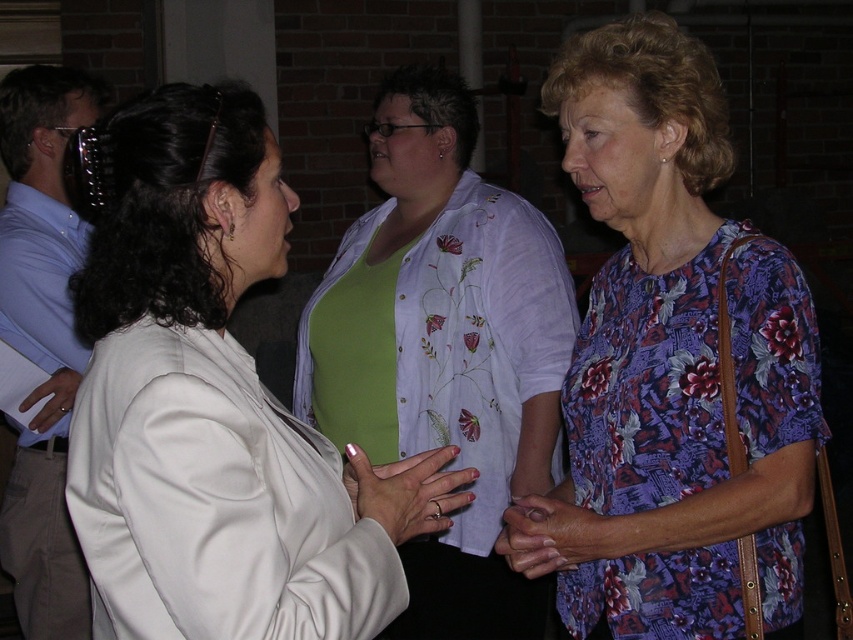
Based on the photo, is light blue shirt at left taller than matte white hand at center?

Yes.

Looking at this image, who is more forward, (15,280) or (352,468)?

Positioned in front is point (352,468).

I want to click on light blue shirt at left, so click(42, 339).

Locate an element on the screen. This screenshot has height=640, width=853. matte white blazer at left is located at coordinates (216, 406).

Is matte white blazer at left shorter than green embroidered blouse at center?

Yes.

Where is `matte white blazer at left`? This screenshot has height=640, width=853. matte white blazer at left is located at coordinates (216, 406).

What do you see at coordinates (42, 339) in the screenshot?
I see `light blue shirt at left` at bounding box center [42, 339].

Consider the image. Can you confirm if light blue shirt at left is thinner than floral fabric hand at center?

No, light blue shirt at left is not thinner than floral fabric hand at center.

From the picture: Who is more distant from viewer, (55, 442) or (535, 509)?

Positioned behind is point (55, 442).

Where is `light blue shirt at left`? light blue shirt at left is located at coordinates (42, 339).